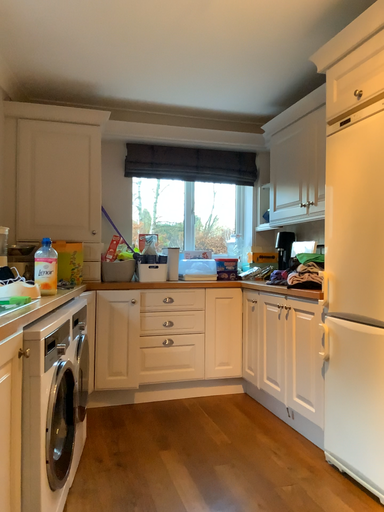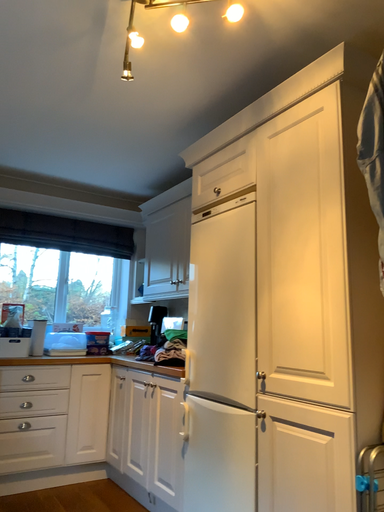
Question: How did the camera likely rotate when shooting the video?

Choices:
 (A) rotated right
 (B) rotated left

Answer: (A)